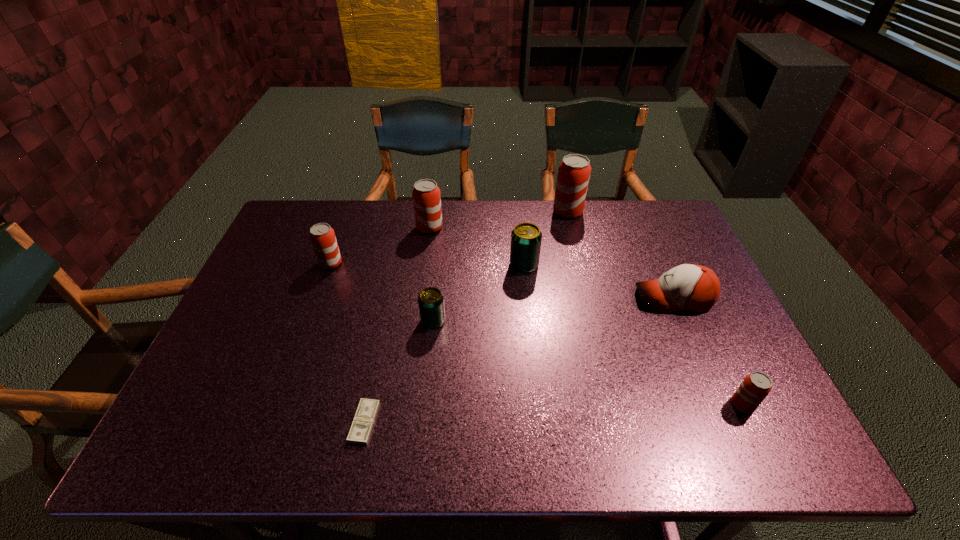
This screenshot has height=540, width=960. Find the location of `the tallest beer can`. the tallest beer can is located at coordinates (574, 171).

You are a GUI agent. You are given a task and a screenshot of the screen. Output one action in this format:
    pyautogui.click(x=<x>, y=<y>)
    Task: Click on the third object from right to left
    
    Given the screenshot: What is the action you would take?
    pyautogui.click(x=574, y=171)

In order to click on the fifth shortest beer can in this screenshot , I will do (426, 195).

This screenshot has width=960, height=540. I want to click on the third orange beer can from right to left, so click(x=426, y=195).

Where is `the leftmost orange beer can`? This screenshot has height=540, width=960. the leftmost orange beer can is located at coordinates (322, 236).

Locate an element on the screen. the leftmost object is located at coordinates (322, 236).

You are a GUI agent. You are given a task and a screenshot of the screen. Output one action in this format:
    pyautogui.click(x=<x>, y=<y>)
    Task: Click on the farther green beer can
    This screenshot has height=540, width=960.
    Given the screenshot: What is the action you would take?
    pyautogui.click(x=526, y=238)

Image resolution: width=960 pixels, height=540 pixels. Find the location of `the fourth object from right to left`. the fourth object from right to left is located at coordinates (526, 238).

This screenshot has height=540, width=960. Identify the location of baseball cap. (690, 287).

Identify the location of the nearer green beer can. (430, 300).